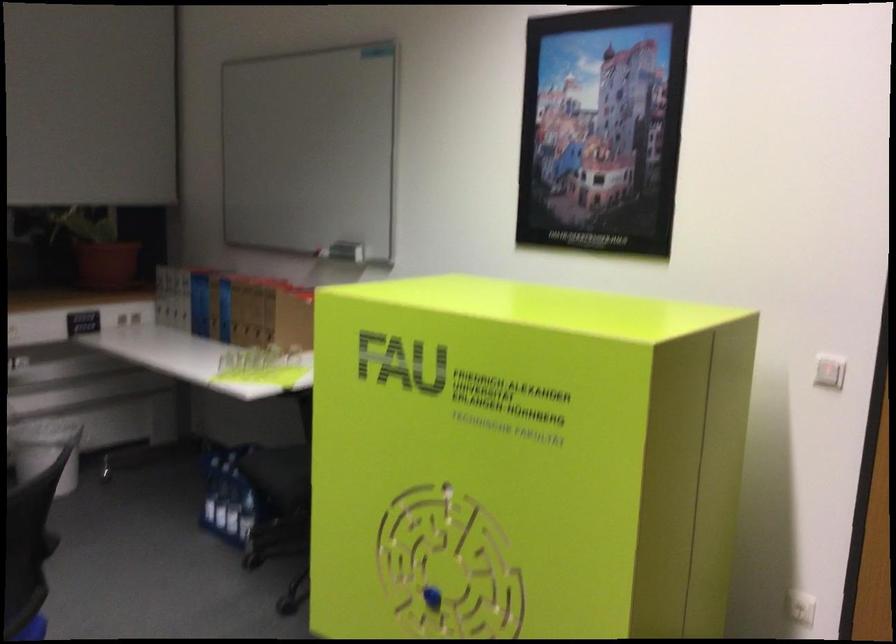
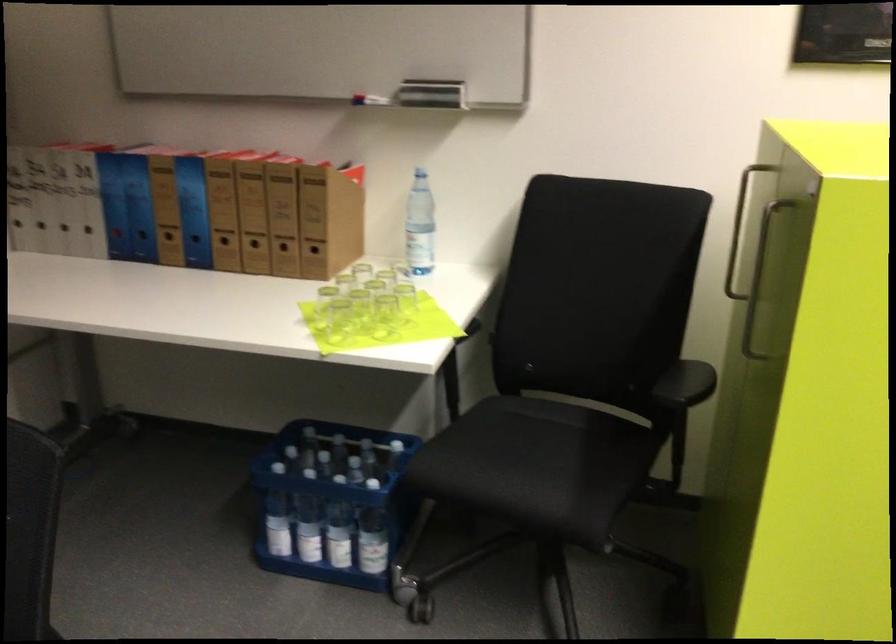
In the second image, find the point that corresponds to pixel 259 336 in the first image.

(283, 252)